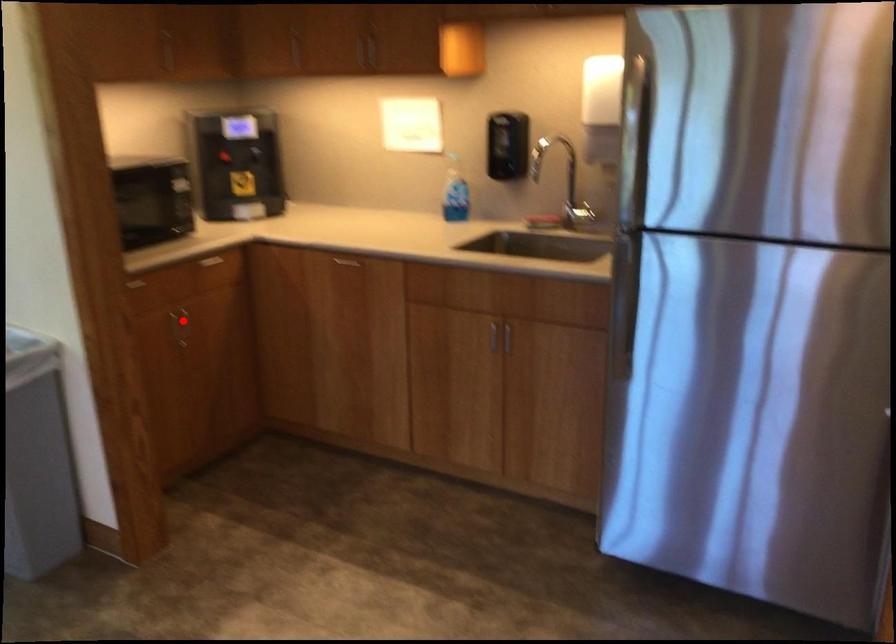
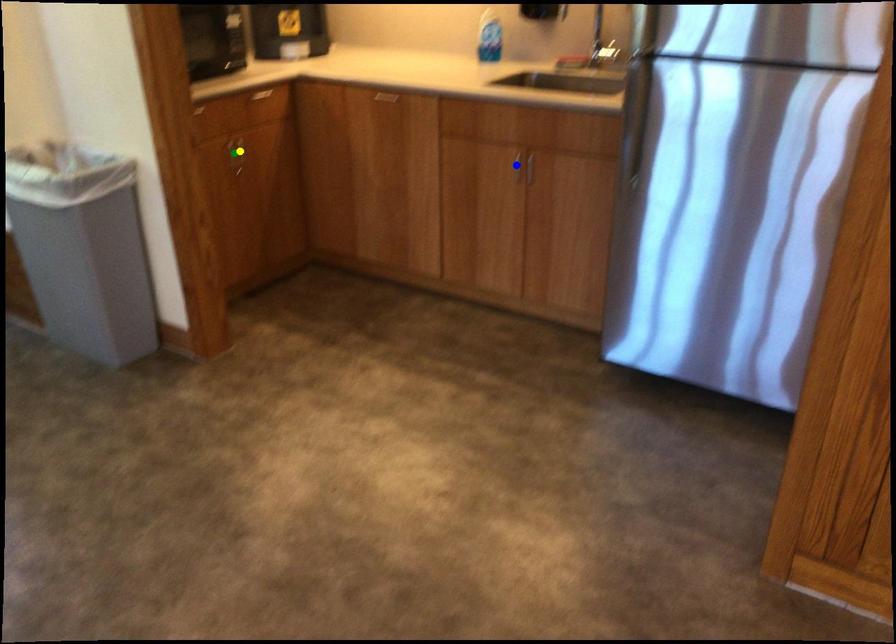
Question: I am providing you with two images of the same scene from different viewpoints. A red point is marked on the first image. You are given multiple points on the second image. Which point in image 2 is actually the same real-world point as the red point in image 1?

Choices:
 (A) green point
 (B) yellow point
 (C) blue point

Answer: (B)